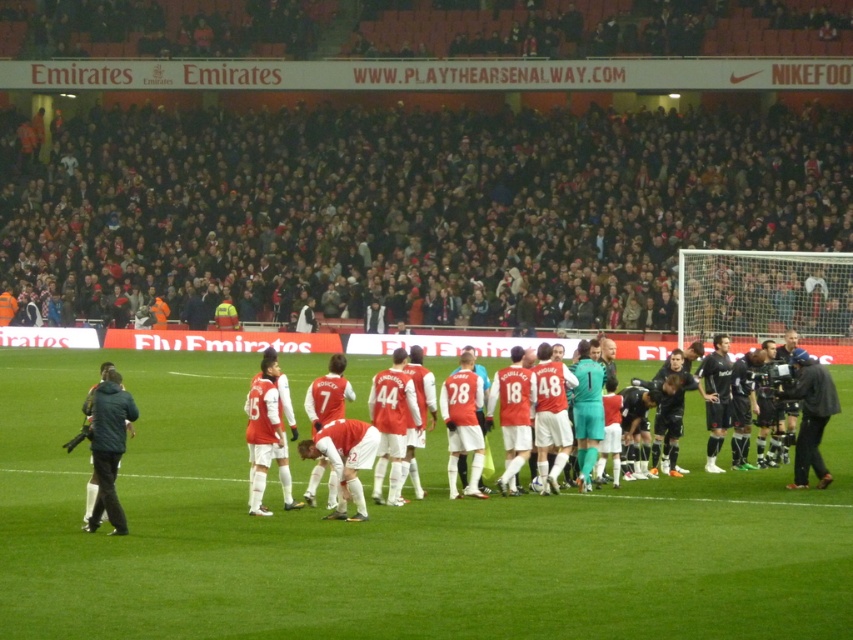
Question: Is dark green jacket at left to the right of red matte jersey at center from the viewer's perspective?

Choices:
 (A) yes
 (B) no

Answer: (B)

Question: Estimate the real-world distances between objects in this image. Which object is farther from the red matte jersey at center?

Choices:
 (A) green grass field at center
 (B) black leather jacket at right

Answer: (A)

Question: Which of the following is the closest to the observer?

Choices:
 (A) dark green jacket at left
 (B) black leather jacket at right
 (C) green grass field at center

Answer: (C)

Question: Among these points, which one is nearest to the camera?

Choices:
 (A) (122, 531)
 (B) (354, 564)
 (C) (317, 481)

Answer: (B)

Question: Does green grass field at center appear on the right side of dark green jacket at left?

Choices:
 (A) yes
 (B) no

Answer: (A)

Question: Does dark green jacket at left lie in front of black leather jacket at right?

Choices:
 (A) no
 (B) yes

Answer: (B)